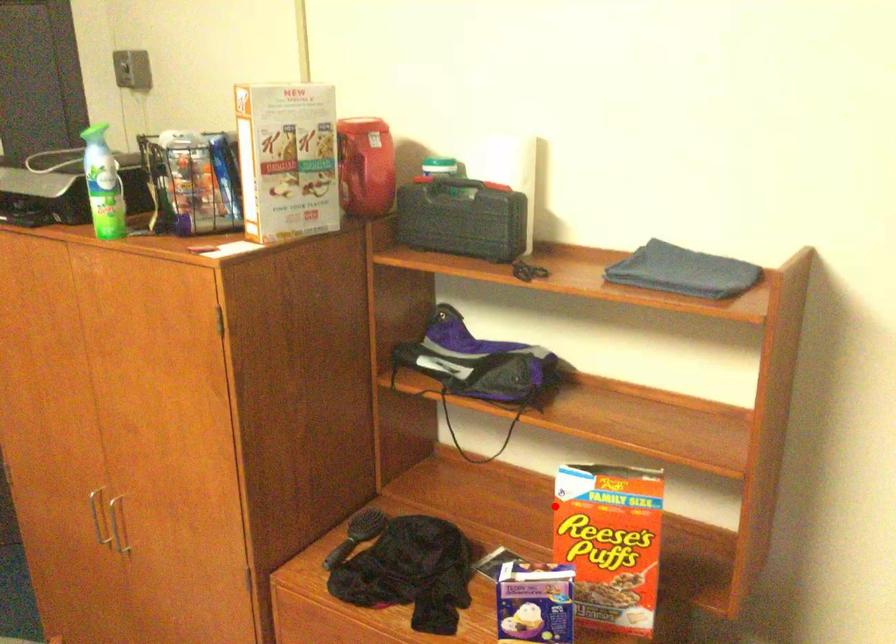
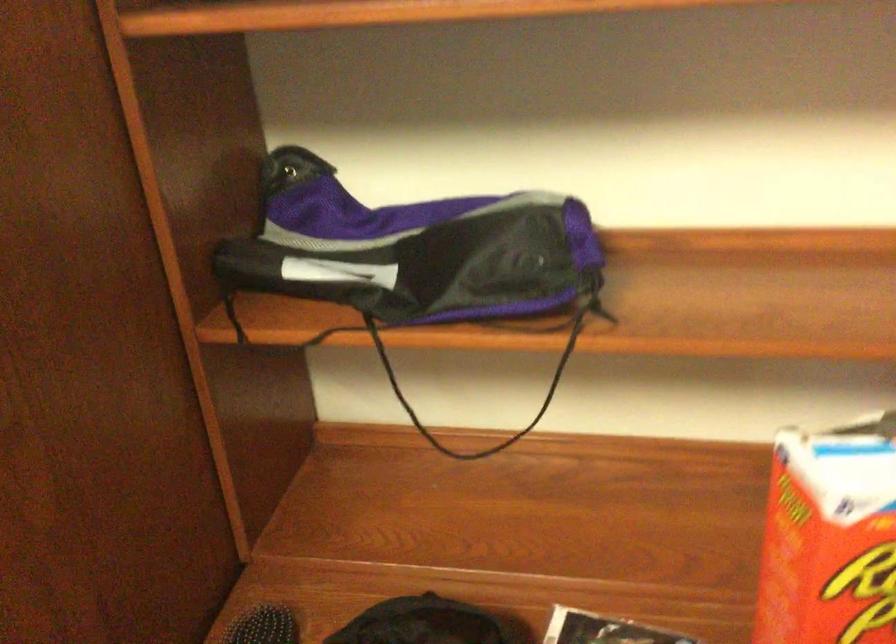
Question: I am providing you with two images of the same scene from different viewpoints. A red point is shown in image1. For the corresponding object point in image2, is it positioned nearer or farther from the camera?

Choices:
 (A) Nearer
 (B) Farther

Answer: (A)